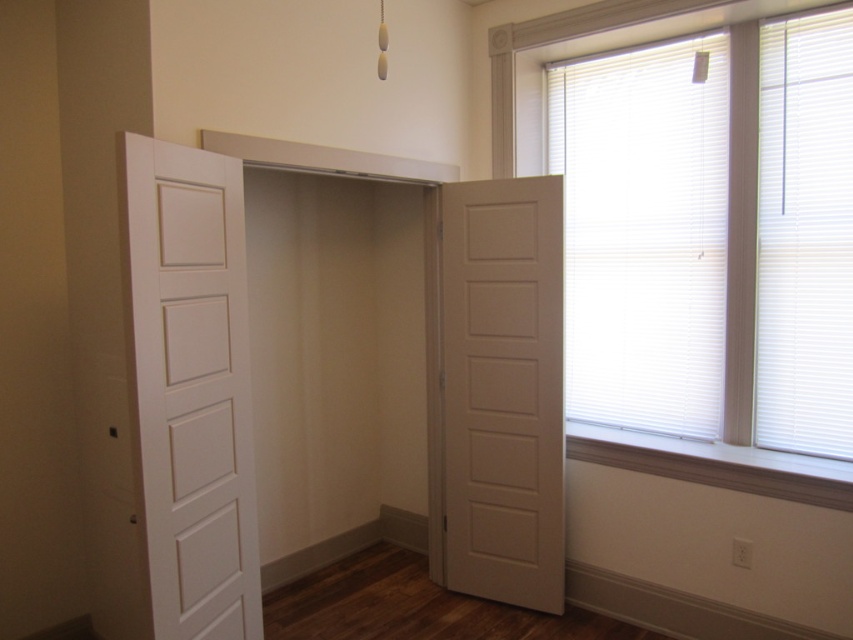
Which is in front, point (144, 298) or point (744, 452)?

Point (144, 298)

Does white matte door at left appear on the left side of white blinds at upper right?

Indeed, white matte door at left is positioned on the left side of white blinds at upper right.

Does point (207, 484) lie in front of point (737, 141)?

Yes, it is.

Find the location of a particular element. white matte door at left is located at coordinates (192, 388).

Does white matte door at right have a lesser width compared to white blinds at upper right?

Yes.

Does white matte door at right have a lesser height compared to white blinds at upper right?

Yes.

Does point (556, 458) come closer to viewer compared to point (514, 48)?

Yes.

You are a GUI agent. You are given a task and a screenshot of the screen. Output one action in this format:
    pyautogui.click(x=<x>, y=<y>)
    Task: Click on the white matte door at right
    
    Given the screenshot: What is the action you would take?
    pyautogui.click(x=503, y=388)

Can you confirm if white matte door at left is positioned to the right of white matte door at right?

No, white matte door at left is not to the right of white matte door at right.

The height and width of the screenshot is (640, 853). In order to click on white matte door at left in this screenshot , I will do `click(192, 388)`.